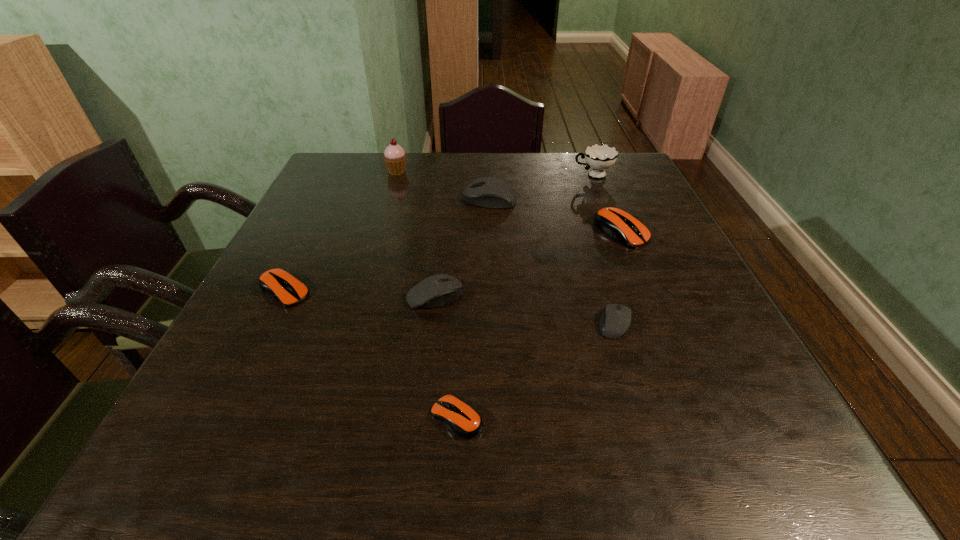
Image resolution: width=960 pixels, height=540 pixels. I want to click on the third closest computer mouse to the second nearest orange computer mouse, so click(x=489, y=192).

What are the coordinates of `the second closest black computer equipment to the smallest black computer equipment` in the screenshot? It's located at (489, 192).

Point out which black computer equipment is positioned as the second nearest to the third tallest object. Please provide its 2D coordinates. Your answer should be formatted as a tuple, i.e. [(x, y)], where the tuple contains the x and y coordinates of a point satisfying the conditions above.

[(615, 321)]

Locate which orange computer mouse is the second closest to the cup. Please provide its 2D coordinates. Your answer should be formatted as a tuple, i.e. [(x, y)], where the tuple contains the x and y coordinates of a point satisfying the conditions above.

[(279, 284)]

Image resolution: width=960 pixels, height=540 pixels. I want to click on orange computer mouse that is the second closest to the second smallest black computer equipment, so click(x=279, y=284).

Identify the location of free location that satisfies the following two spatial constraints: 1. on the front side of the farthest black computer equipment; 2. on the left side of the smallest black computer equipment. This screenshot has height=540, width=960. (492, 323).

This screenshot has width=960, height=540. In order to click on blank space that satisfies the following two spatial constraints: 1. on the front side of the second farthest orange computer mouse; 2. on the left side of the rightmost black computer equipment in this screenshot , I will do `click(269, 323)`.

Image resolution: width=960 pixels, height=540 pixels. What are the coordinates of `vacant area that satisfies the following two spatial constraints: 1. on the back side of the nearest computer mouse; 2. on the right side of the third farthest object` in the screenshot? It's located at (467, 199).